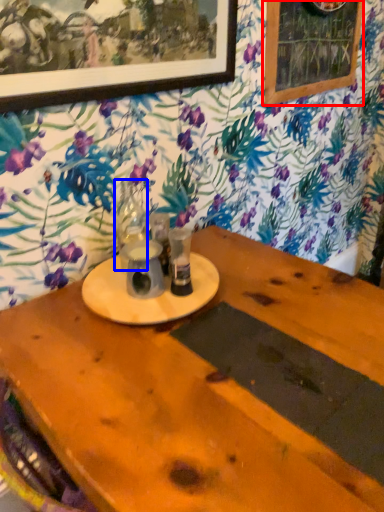
Question: Among these objects, which one is nearest to the camera, bulletin board (highlighted by a red box) or tableware (highlighted by a blue box)?

Choices:
 (A) bulletin board
 (B) tableware

Answer: (B)